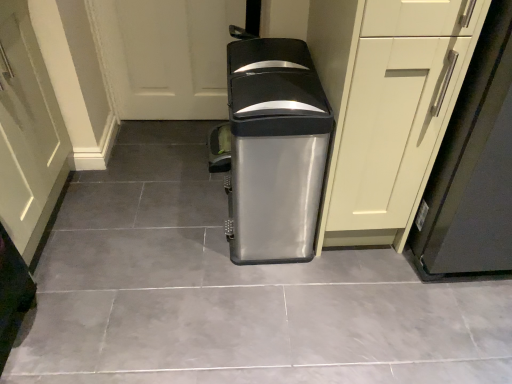
Question: Looking at their shapes, would you say matte white cabinet at center is wider or thinner than satin metallic trash can at center?

Choices:
 (A) thin
 (B) wide

Answer: (A)

Question: From the image's perspective, is matte white cabinet at center above or below satin metallic trash can at center?

Choices:
 (A) below
 (B) above

Answer: (B)

Question: Which is farther from the satin metallic trash can at center?

Choices:
 (A) satin silver trash can at center
 (B) matte white cabinet at right
 (C) matte green door at lower left
 (D) matte white cabinet at center

Answer: (C)

Question: Which object is the closest to the matte white cabinet at center?

Choices:
 (A) matte white cabinet at right
 (B) matte green door at lower left
 (C) satin silver trash can at center
 (D) satin metallic trash can at center

Answer: (A)